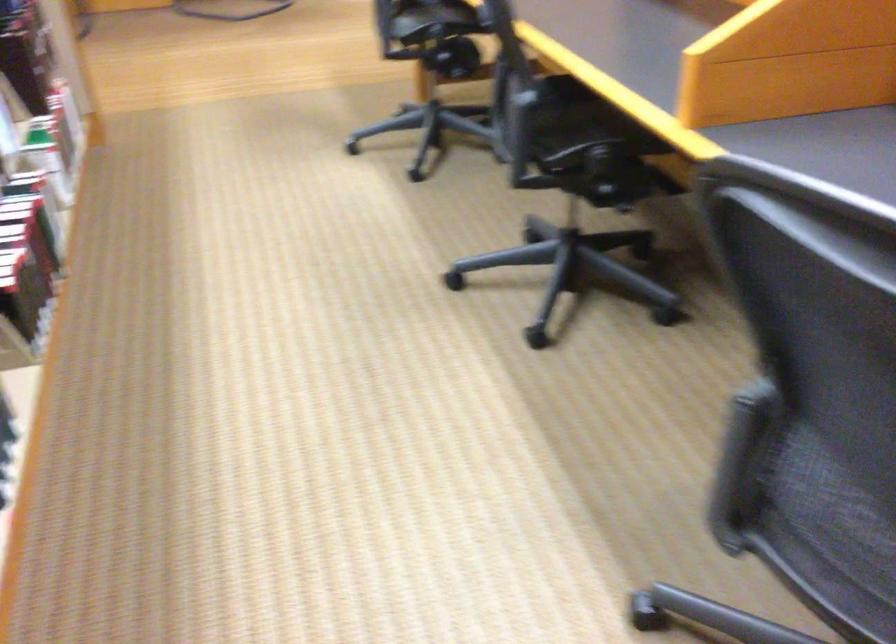
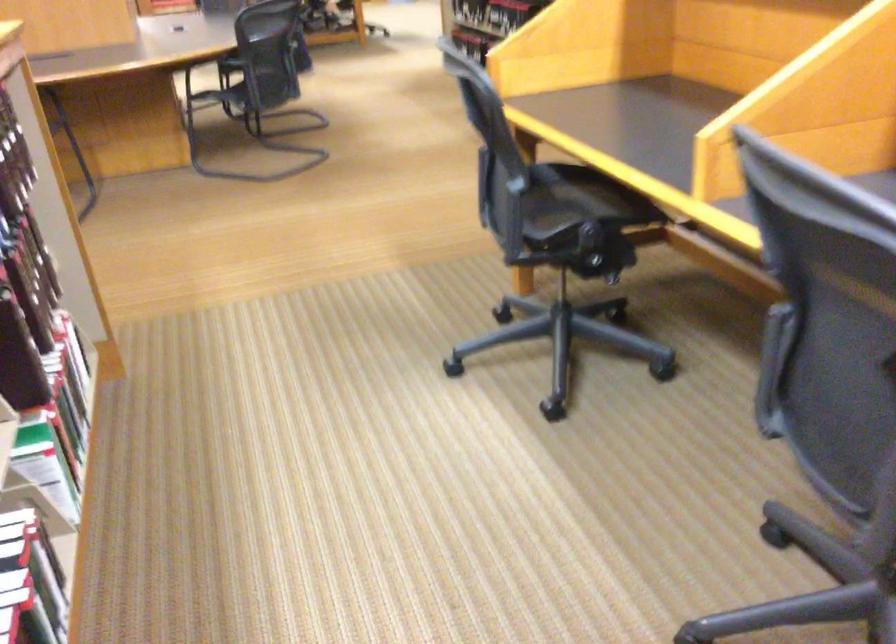
Which direction would the cameraman need to move to produce the second image?

The cameraman moved toward left, forward.